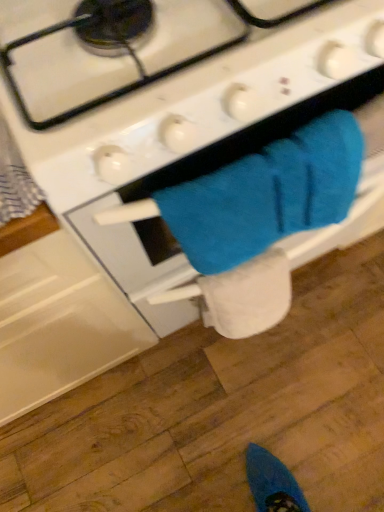
Question: Should I look upward or downward to see white soft toilet paper at lower center?

Choices:
 (A) down
 (B) up

Answer: (A)

Question: Is white matte gas stove at center located outside blue fuzzy towel at center?

Choices:
 (A) no
 (B) yes

Answer: (B)

Question: Is white matte gas stove at center positioned with its back to blue fuzzy towel at center?

Choices:
 (A) yes
 (B) no

Answer: (B)

Question: Is white matte gas stove at center positioned far away from blue fuzzy towel at center?

Choices:
 (A) yes
 (B) no

Answer: (B)

Question: Does white matte gas stove at center have a greater width compared to blue fuzzy towel at center?

Choices:
 (A) yes
 (B) no

Answer: (A)

Question: Can you confirm if white matte gas stove at center is smaller than blue fuzzy towel at center?

Choices:
 (A) yes
 (B) no

Answer: (B)

Question: From the image's perspective, is white matte gas stove at center below blue fuzzy towel at center?

Choices:
 (A) no
 (B) yes

Answer: (A)

Question: Can you confirm if white soft toilet paper at lower center is thinner than blue fuzzy towel at center?

Choices:
 (A) no
 (B) yes

Answer: (A)

Question: From the image's perspective, does white soft toilet paper at lower center appear higher than blue fuzzy towel at center?

Choices:
 (A) no
 (B) yes

Answer: (A)

Question: Can you confirm if white soft toilet paper at lower center is shorter than blue fuzzy towel at center?

Choices:
 (A) no
 (B) yes

Answer: (B)

Question: Is white soft toilet paper at lower center at the left side of blue fuzzy towel at center?

Choices:
 (A) no
 (B) yes

Answer: (B)

Question: Does white soft toilet paper at lower center come behind blue fuzzy towel at center?

Choices:
 (A) no
 (B) yes

Answer: (B)

Question: Are white soft toilet paper at lower center and blue fuzzy towel at center making contact?

Choices:
 (A) yes
 (B) no

Answer: (B)

Question: Does white matte gas stove at center have a greater height compared to white soft toilet paper at lower center?

Choices:
 (A) yes
 (B) no

Answer: (A)